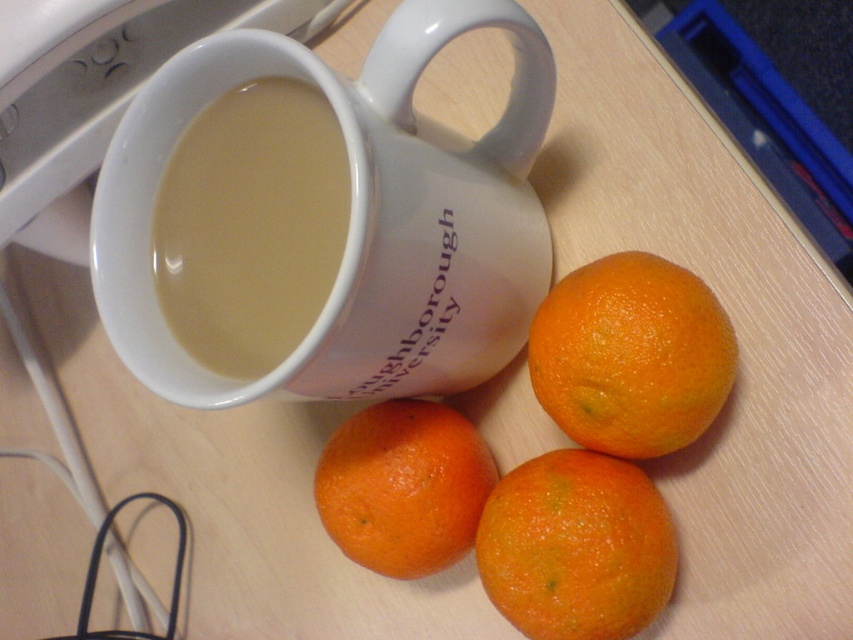
Can you confirm if white ceramic mug at upper center is positioned above orangesmoothorange at lower center?

Correct, white ceramic mug at upper center is located above orangesmoothorange at lower center.

Between white ceramic mug at upper center and orangesmoothorange at lower center, which one is positioned higher?

white ceramic mug at upper center

This screenshot has height=640, width=853. I want to click on white ceramic mug at upper center, so pos(354,216).

Image resolution: width=853 pixels, height=640 pixels. I want to click on white ceramic mug at upper center, so click(x=354, y=216).

Which of these two, white ceramic mug at upper center or orange matte/orange at center, stands shorter?

Standing shorter between the two is orange matte/orange at center.

Does white ceramic mug at upper center have a lesser height compared to orange matte/orange at center?

Incorrect, white ceramic mug at upper center's height does not fall short of orange matte/orange at center's.

Where is `white ceramic mug at upper center`? white ceramic mug at upper center is located at coordinates (354, 216).

Where is `orange matte at center`? The height and width of the screenshot is (640, 853). orange matte at center is located at coordinates (576, 547).

Based on the photo, does orange matte at center appear on the right side of orangesmoothorange at lower center?

Indeed, orange matte at center is positioned on the right side of orangesmoothorange at lower center.

What do you see at coordinates (576, 547) in the screenshot? I see `orange matte at center` at bounding box center [576, 547].

The width and height of the screenshot is (853, 640). Identify the location of orange matte at center. (576, 547).